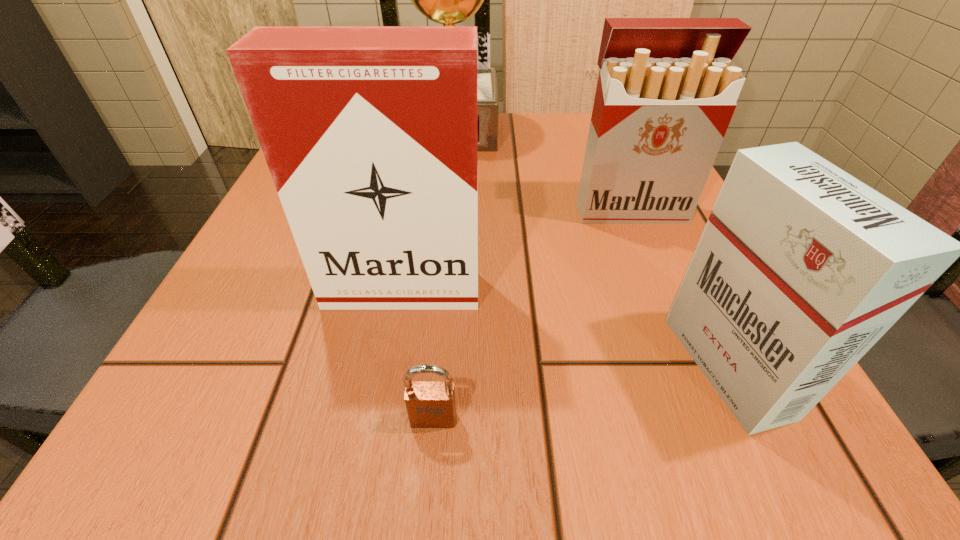
At what (x,y) coordinates should I click in order to perform the action: click on unoccupied area between the farthest cigarette case and the shortest object. Please return your answer as a coordinate pair (x, y). The width and height of the screenshot is (960, 540). Looking at the image, I should click on (532, 314).

This screenshot has width=960, height=540. I want to click on vacant space that is in between the farthest object and the second shortest object, so click(x=589, y=248).

This screenshot has width=960, height=540. Find the location of `unoccupied area between the farthest cigarette case and the shortest object`. unoccupied area between the farthest cigarette case and the shortest object is located at coordinates (532, 314).

What are the coordinates of `empty location between the fourth nearest object and the shortest object` in the screenshot? It's located at (532, 314).

At what (x,y) coordinates should I click in order to perform the action: click on unoccupied position between the leftmost cigarette case and the padlock. Please return your answer as a coordinate pair (x, y). Image resolution: width=960 pixels, height=540 pixels. Looking at the image, I should click on (418, 355).

Find the location of a particular element. Image resolution: width=960 pixels, height=540 pixels. the closest object relative to the padlock is located at coordinates (370, 133).

Locate an element on the screen. The width and height of the screenshot is (960, 540). object that is the closest to the farthest object is located at coordinates (667, 88).

Identify the location of cigarette case that is the nearest to the fourth tallest object. (667, 88).

In order to click on cigarette case that is the second closest to the third nearest object in this screenshot , I will do `click(801, 268)`.

Locate an element on the screen. The image size is (960, 540). free space that satisfies the following two spatial constraints: 1. on the front-facing side of the award; 2. on the left side of the nearest cigarette case is located at coordinates (431, 366).